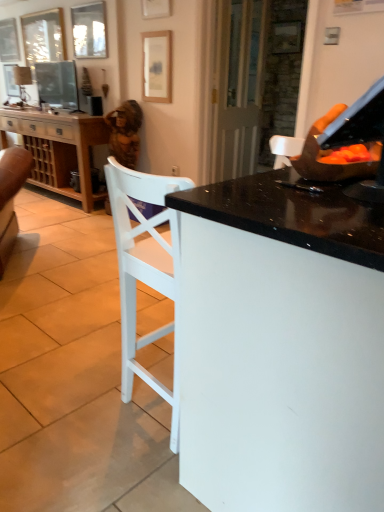
Question: From a real-world perspective, is matte black pan at upper right physically below matte white lampshade at upper left?

Choices:
 (A) no
 (B) yes

Answer: (B)

Question: Does matte black pan at upper right have a lesser width compared to matte white lampshade at upper left?

Choices:
 (A) no
 (B) yes

Answer: (B)

Question: Is the depth of matte black pan at upper right greater than that of matte white lampshade at upper left?

Choices:
 (A) no
 (B) yes

Answer: (A)

Question: Would you say matte white lampshade at upper left is part of matte black pan at upper right's contents?

Choices:
 (A) yes
 (B) no

Answer: (B)

Question: Is matte black pan at upper right not close to matte white lampshade at upper left?

Choices:
 (A) yes
 (B) no

Answer: (A)

Question: From a real-world perspective, does matte black pan at upper right stand above matte white lampshade at upper left?

Choices:
 (A) yes
 (B) no

Answer: (B)

Question: Is matte white lampshade at upper left at the back of matte glass picture frame at upper left, which is the third picture frame from front to back?

Choices:
 (A) yes
 (B) no

Answer: (B)

Question: Is matte glass picture frame at upper left, which is the third picture frame from front to back, positioned before matte white lampshade at upper left?

Choices:
 (A) no
 (B) yes

Answer: (B)

Question: Is matte glass picture frame at upper left, the third picture frame viewed from the right, thinner than matte white lampshade at upper left?

Choices:
 (A) yes
 (B) no

Answer: (A)

Question: Is matte glass picture frame at upper left, which is the third picture frame from front to back, not near matte white lampshade at upper left?

Choices:
 (A) yes
 (B) no

Answer: (A)

Question: Can you confirm if matte glass picture frame at upper left, the 3th picture frame when ordered from back to front, is shorter than matte white lampshade at upper left?

Choices:
 (A) no
 (B) yes

Answer: (A)

Question: Does matte glass picture frame at upper left, positioned as the third picture frame in left-to-right order, lie behind matte white lampshade at upper left?

Choices:
 (A) yes
 (B) no

Answer: (B)

Question: Are matte glass picture frame at upper left, which is the third picture frame from front to back, and brown textured statue at upper left making contact?

Choices:
 (A) yes
 (B) no

Answer: (B)